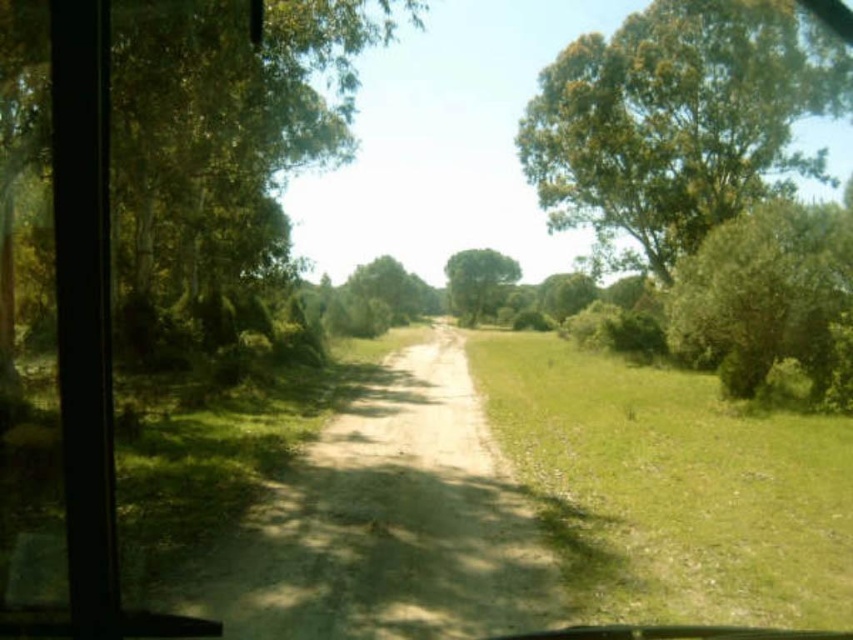
You are driving along a rural road and notice the green grass at center and the green leafy tree at center through the window. Which object is closer to the left side of the window?

The green grass at center is positioned on the left side of green leafy tree at center, so the green grass at center is closer to the left side of the window.

You are driving along the road and need to know if the dusty brown dirt track at center is wide enough to pass another vehicle coming from the opposite direction. Can you determine this based on the green leafy tree at upper right?

The dusty brown dirt track at center is thinner than the green leafy tree at upper right, so it may not be wide enough to safely pass another vehicle coming from the opposite direction.